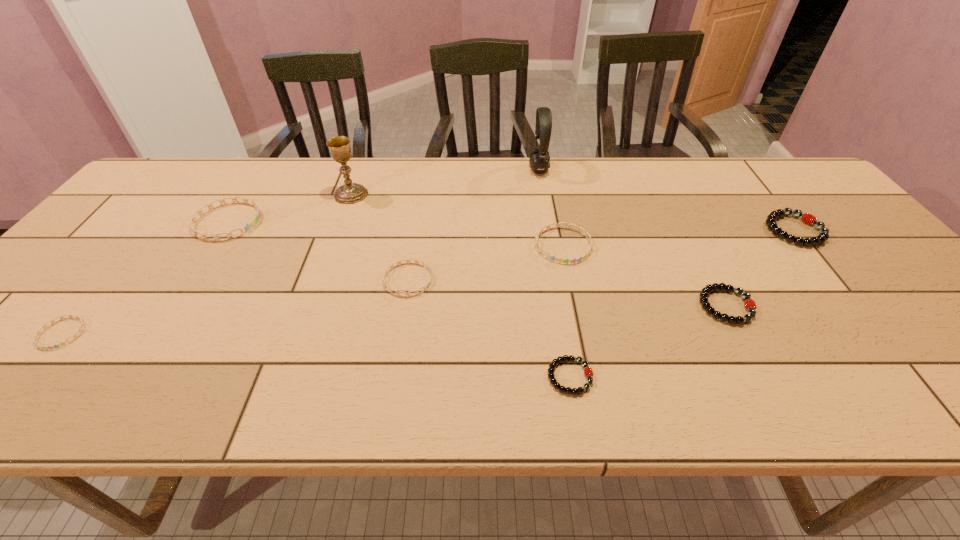
Select which black bracelet is the third closest to the eighth object from right to left. Please provide its 2D coordinates. Your answer should be formatted as a tuple, i.e. [(x, y)], where the tuple contains the x and y coordinates of a point satisfying the conditions above.

[(807, 218)]

The image size is (960, 540). Identify the location of black bracelet object that ranks as the second closest to the third blue bracelet from right to left. (750, 305).

Locate an element on the screen. blank area in the image that satisfies the following two spatial constraints: 1. on the front-facing side of the headset; 2. on the front side of the chalice is located at coordinates (543, 194).

Locate an element on the screen. Image resolution: width=960 pixels, height=540 pixels. free space that satisfies the following two spatial constraints: 1. on the surface of the eighth object from right to left showing star-shaped elements; 2. on the surface of the leftmost bracelet showing star-shaped elements is located at coordinates (155, 333).

Find the location of a particular element. free region that satisfies the following two spatial constraints: 1. on the back side of the second biggest black bracelet; 2. on the right side of the biggest black bracelet is located at coordinates (686, 230).

This screenshot has height=540, width=960. Find the location of `vacant space that satisfies the following two spatial constraints: 1. on the front-facing side of the farthest object; 2. on the right side of the rightmost object`. vacant space that satisfies the following two spatial constraints: 1. on the front-facing side of the farthest object; 2. on the right side of the rightmost object is located at coordinates (549, 230).

At what (x,y) coordinates should I click in order to perform the action: click on vacant area in the image that satisfies the following two spatial constraints: 1. on the surface of the fourth object from left to right showing star-shaped elements; 2. on the surface of the leftmost blue bracelet showing star-shaped elements. Please return your answer as a coordinate pair (x, y). This screenshot has height=540, width=960. Looking at the image, I should click on (399, 333).